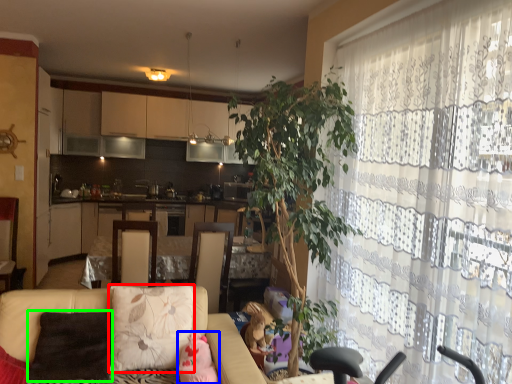
Question: Considering the real-world distances, which object is farthest from pillow (highlighted by a red box)? toy (highlighted by a blue box) or pillow (highlighted by a green box)?

Choices:
 (A) toy
 (B) pillow

Answer: (A)